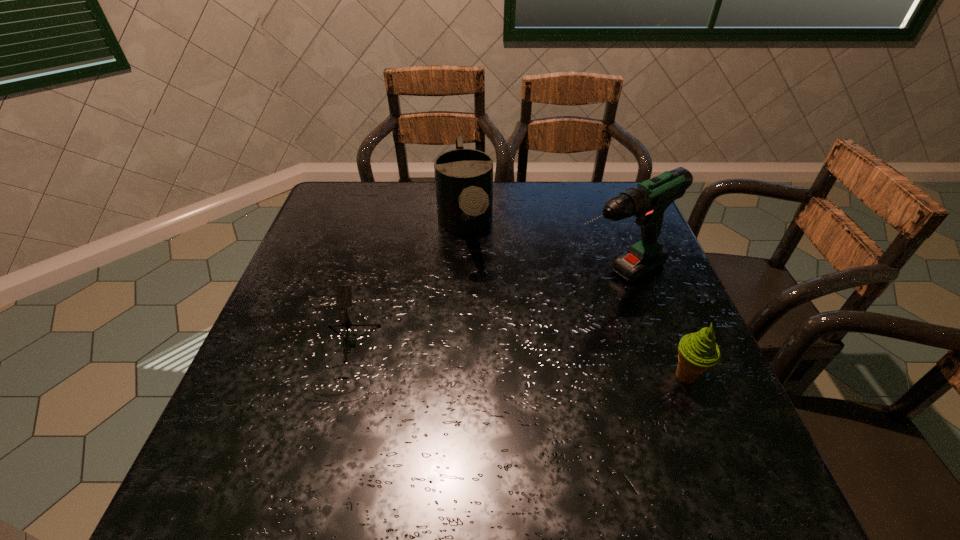
You are a GUI agent. You are given a task and a screenshot of the screen. Output one action in this format:
    pyautogui.click(x=<x>, y=<y>)
    Task: Click on the free space located 0.380m with the spout on the watering can
    The height and width of the screenshot is (540, 960).
    Given the screenshot: What is the action you would take?
    pyautogui.click(x=490, y=407)

Find the location of `free space located 0.320m on the handle side of the tallest object`. free space located 0.320m on the handle side of the tallest object is located at coordinates (463, 356).

Find the location of a particular element. This screenshot has height=540, width=960. vacant region located on the handle side of the tallest object is located at coordinates (494, 339).

Image resolution: width=960 pixels, height=540 pixels. What are the coordinates of `vacant space located on the handle side of the tallest object` in the screenshot? It's located at (501, 335).

This screenshot has height=540, width=960. I want to click on object present at the far edge, so click(463, 177).

Where is `object that is at the near edge`? object that is at the near edge is located at coordinates (344, 292).

Image resolution: width=960 pixels, height=540 pixels. Find the location of `object that is positioned at the left edge`. object that is positioned at the left edge is located at coordinates point(344,292).

Locate an element on the screen. Image resolution: width=960 pixels, height=540 pixels. icecream at the right edge is located at coordinates (697, 351).

Locate an element on the screen. The height and width of the screenshot is (540, 960). drill located at the right edge is located at coordinates (647, 201).

You are a GUI agent. You are given a task and a screenshot of the screen. Output one action in this format:
    pyautogui.click(x=<x>, y=<y>)
    Task: Click on the object that is at the near left corner
    The image size is (960, 540).
    Given the screenshot: What is the action you would take?
    pyautogui.click(x=344, y=292)